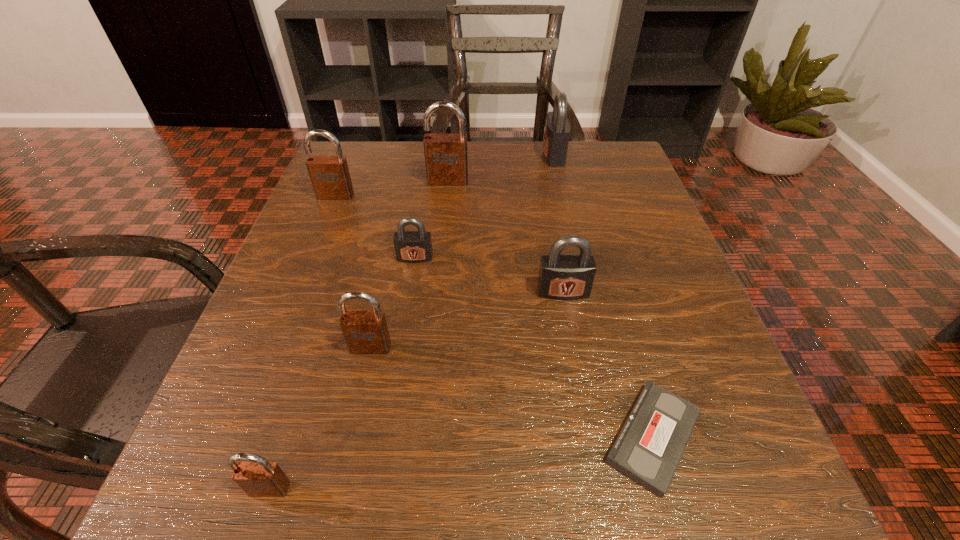
Identify which padlock is the second nearest to the fifth farthest padlock. Please provide its 2D coordinates. Your answer should be formatted as a tuple, i.e. [(x, y)], where the tuple contains the x and y coordinates of a point satisfying the conditions above.

[(365, 332)]

What are the coordinates of `brown padlock that is the second closest to the second farthest padlock` in the screenshot? It's located at (365, 332).

Identify which brown padlock is the nearest to the videotape. Please provide its 2D coordinates. Your answer should be formatted as a tuple, i.e. [(x, y)], where the tuple contains the x and y coordinates of a point satisfying the conditions above.

[(365, 332)]

The height and width of the screenshot is (540, 960). I want to click on gray padlock that is the third closest one to the second brown padlock from right to left, so click(x=557, y=131).

Select which gray padlock appears as the second closest to the leftmost object. Please provide its 2D coordinates. Your answer should be formatted as a tuple, i.e. [(x, y)], where the tuple contains the x and y coordinates of a point satisfying the conditions above.

[(557, 131)]

Identify the location of vacant space that satisfies the following two spatial constraints: 1. on the front of the shortest object near the keyhole; 2. on the right side of the fifth nearest object. The image size is (960, 540). (387, 437).

The height and width of the screenshot is (540, 960). I want to click on free space that satisfies the following two spatial constraints: 1. on the front-facing side of the third smallest brown padlock; 2. on the right side of the shortest object, so click(x=239, y=437).

I want to click on vacant space that satisfies the following two spatial constraints: 1. on the front of the shortest object near the keyhole; 2. on the left side of the fifth nearest object, so click(x=387, y=437).

Locate an element on the screen. The image size is (960, 540). free location that satisfies the following two spatial constraints: 1. on the front of the second smallest gray padlock near the keyhole; 2. on the right side of the shortest object is located at coordinates (589, 437).

What are the coordinates of `vacant space that satisfies the following two spatial constraints: 1. on the front of the farthest object near the keyhole; 2. on the front-facing side of the third farthest padlock` in the screenshot? It's located at (564, 195).